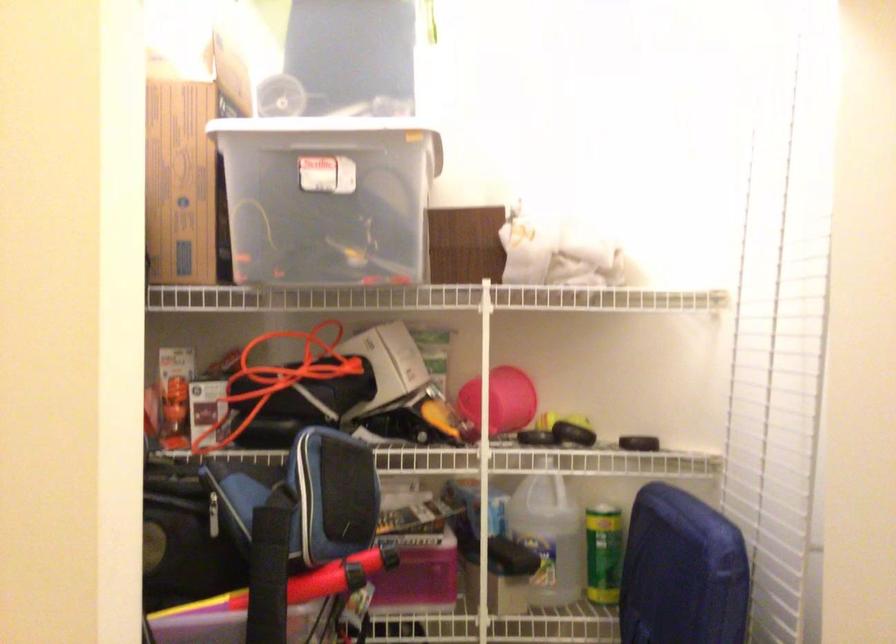
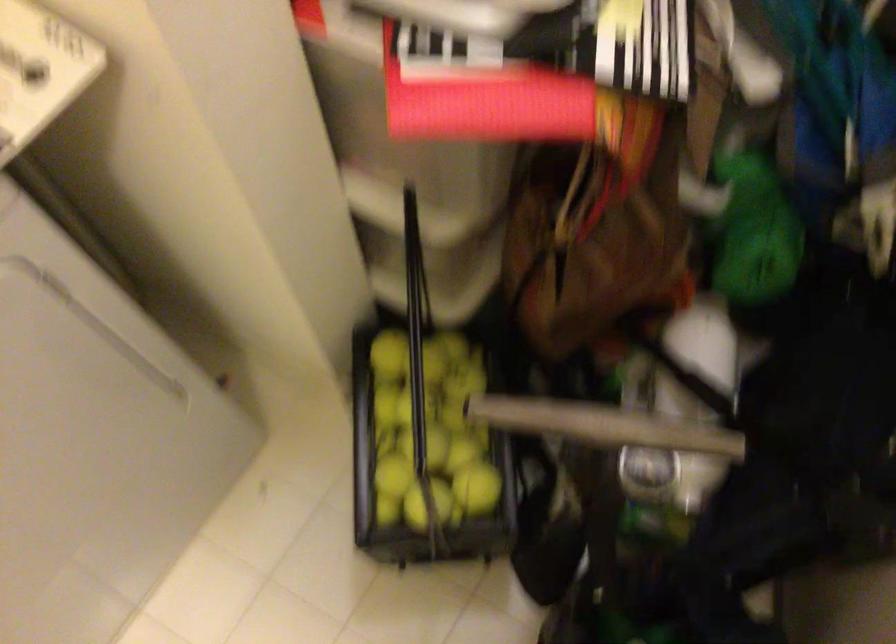
First-person continuous shooting, in which direction is the camera rotating?

The camera rotated toward left-down.